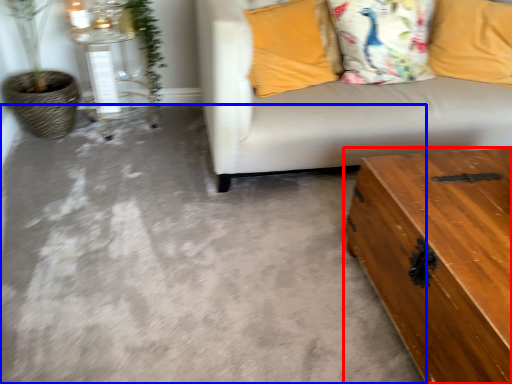
Question: Which object appears closest to the camera in this image, table (highlighted by a red box) or concrete (highlighted by a blue box)?

Choices:
 (A) table
 (B) concrete

Answer: (A)